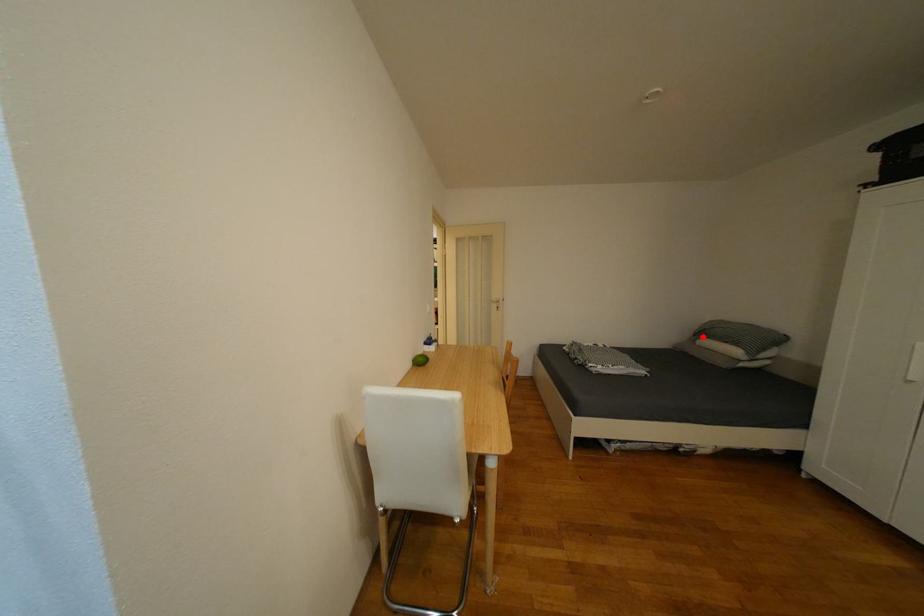
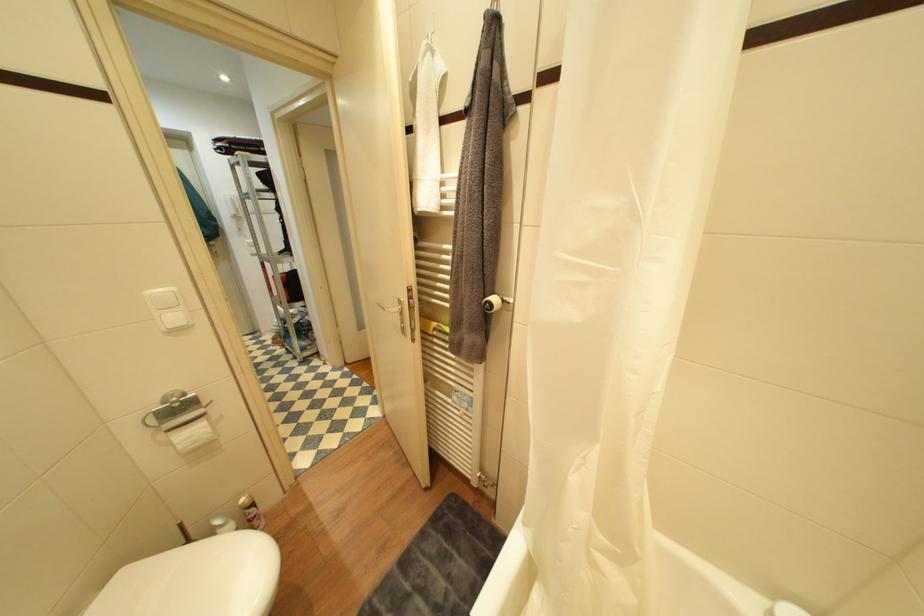
Question: I am providing you with two images of the same scene from different viewpoints. A red point is marked on the first image. Is the red point's position out of view in image 2?

Choices:
 (A) Yes
 (B) No

Answer: (A)